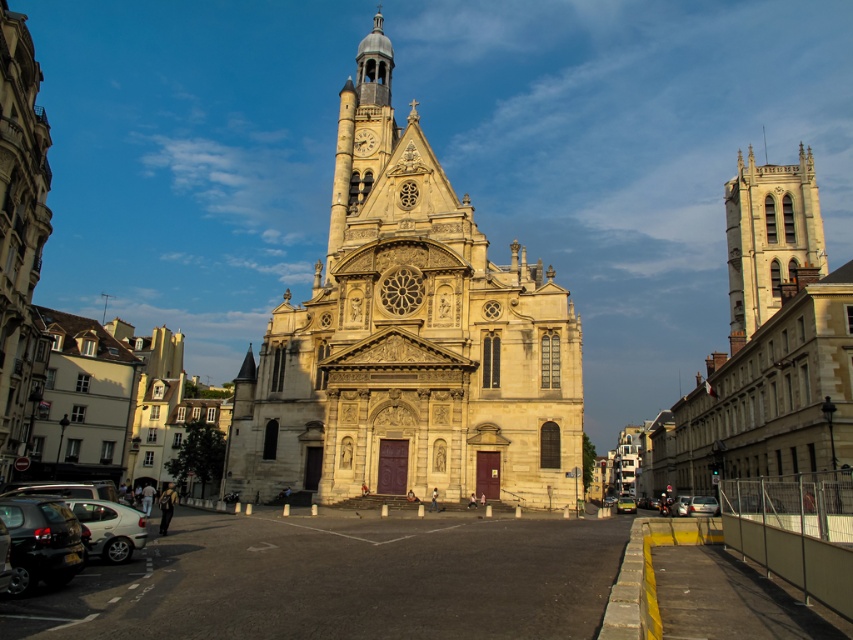
Question: Does silver metallic car at lower right lie behind gold textured clock at upper center?

Choices:
 (A) yes
 (B) no

Answer: (B)

Question: Can you confirm if stone gothic tower at right is positioned to the right of gold textured clock at upper center?

Choices:
 (A) no
 (B) yes

Answer: (B)

Question: Observing the image, what is the correct spatial positioning of gold textured clock at upper center in reference to metallic silver car at center?

Choices:
 (A) above
 (B) below

Answer: (A)

Question: Which point is farther to the camera?

Choices:
 (A) (625, 512)
 (B) (363, 140)

Answer: (B)

Question: Which object is farther from the camera taking this photo?

Choices:
 (A) stone gothic tower at right
 (B) yellow matte taxi at center
 (C) gold textured clock at upper center

Answer: (C)

Question: Which point is closer to the camera?

Choices:
 (A) metallic silver car at center
 (B) light beige stone church at center

Answer: (B)